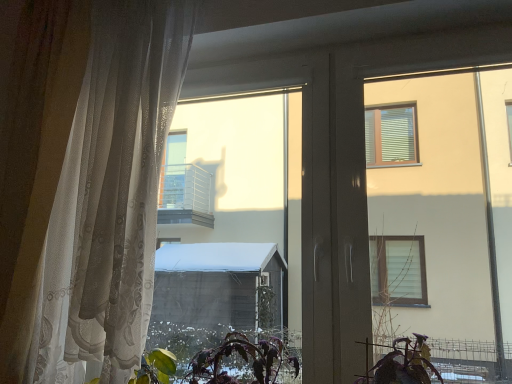
Question: Would you say purple matte plant at lower center is to the left or to the right of sheer white curtain at left in the picture?

Choices:
 (A) right
 (B) left

Answer: (A)

Question: From their relative heights in the image, would you say purple matte plant at lower center is taller or shorter than sheer white curtain at left?

Choices:
 (A) tall
 (B) short

Answer: (B)

Question: Based on their sizes in the image, would you say purple matte plant at lower center is bigger or smaller than sheer white curtain at left?

Choices:
 (A) big
 (B) small

Answer: (B)

Question: From a real-world perspective, is sheer white curtain at left above or below purple matte plant at lower center?

Choices:
 (A) above
 (B) below

Answer: (A)

Question: From the image's perspective, is sheer white curtain at left positioned above or below purple matte plant at lower center?

Choices:
 (A) below
 (B) above

Answer: (B)

Question: Visually, is sheer white curtain at left positioned to the left or to the right of purple matte plant at lower center?

Choices:
 (A) right
 (B) left

Answer: (B)

Question: Is sheer white curtain at left wider or thinner than purple matte plant at lower center?

Choices:
 (A) wide
 (B) thin

Answer: (A)